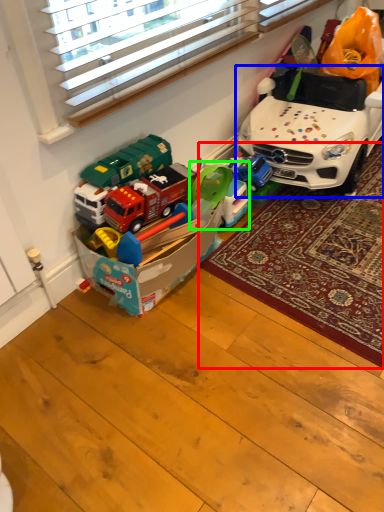
Question: Which object is positioned closest to mat (highlighted by a red box)? Select from car (highlighted by a blue box) and toy (highlighted by a green box).

Choices:
 (A) car
 (B) toy

Answer: (A)